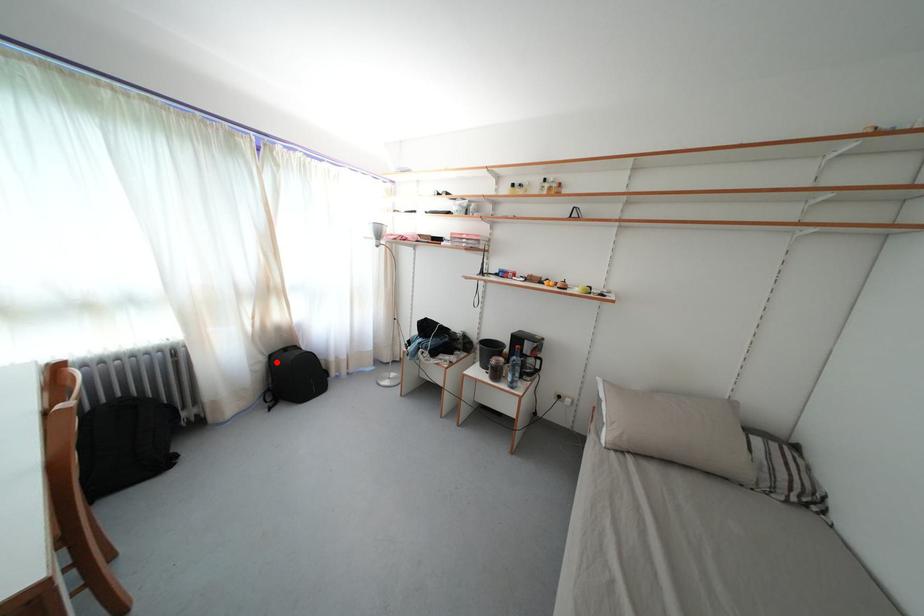
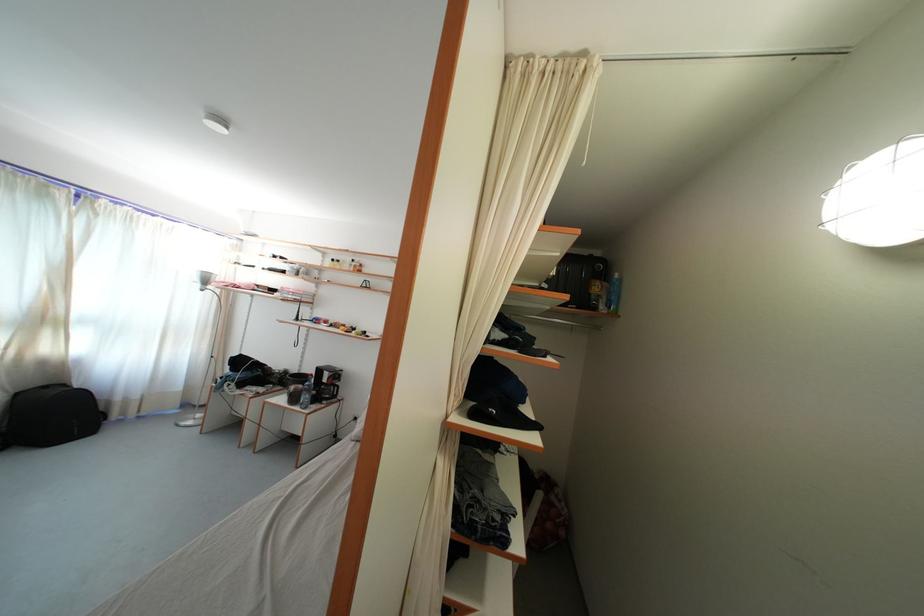
Question: I am providing you with two images of the same scene from different viewpoints. A red point is marked on the first image. At the location where the point appears in image 1, is it still visible in image 2?

Choices:
 (A) Yes
 (B) No

Answer: (A)